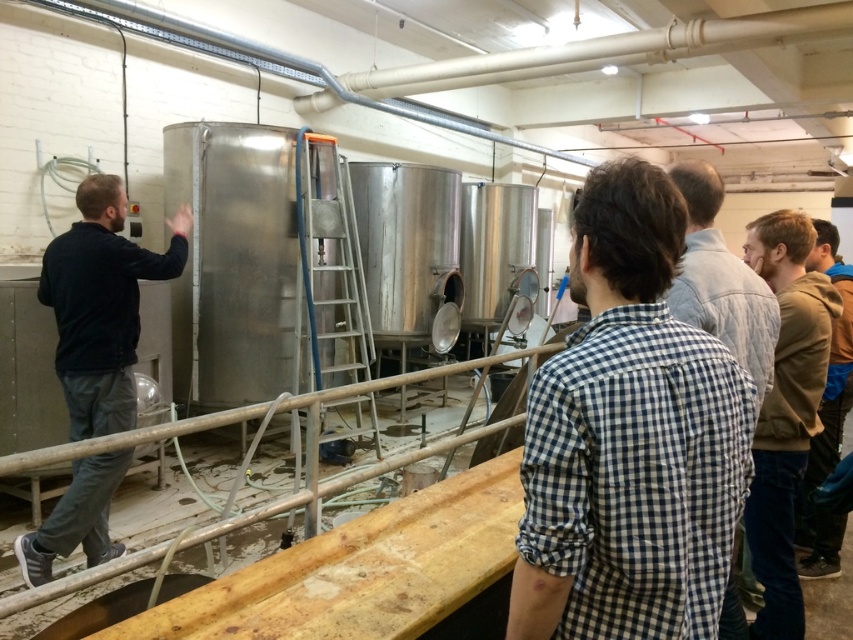
You are standing in the industrial facility and see two points marked in the scene. Which point is closer to you, point (137, 307) or point (728, 260)?

Point (137, 307) is closer to you because it is further to the viewer than point (728, 260).

You are a visitor at this industrial facility and see two people in the scene. One is wearing a checkered fabric shirt at center and the other a dark blue sweater at left. From your perspective, which person is standing more to the right?

The checkered fabric shirt at center is to the right of dark blue sweater at left, so the person in the checkered fabric shirt at center is standing more to the right.